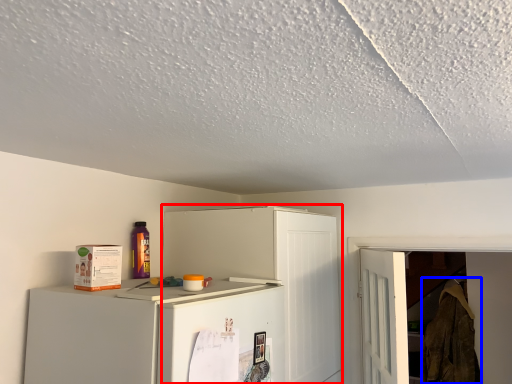
Question: Which of the following is the closest to the observer, cabinetry (highlighted by a red box) or laundry (highlighted by a blue box)?

Choices:
 (A) cabinetry
 (B) laundry

Answer: (A)